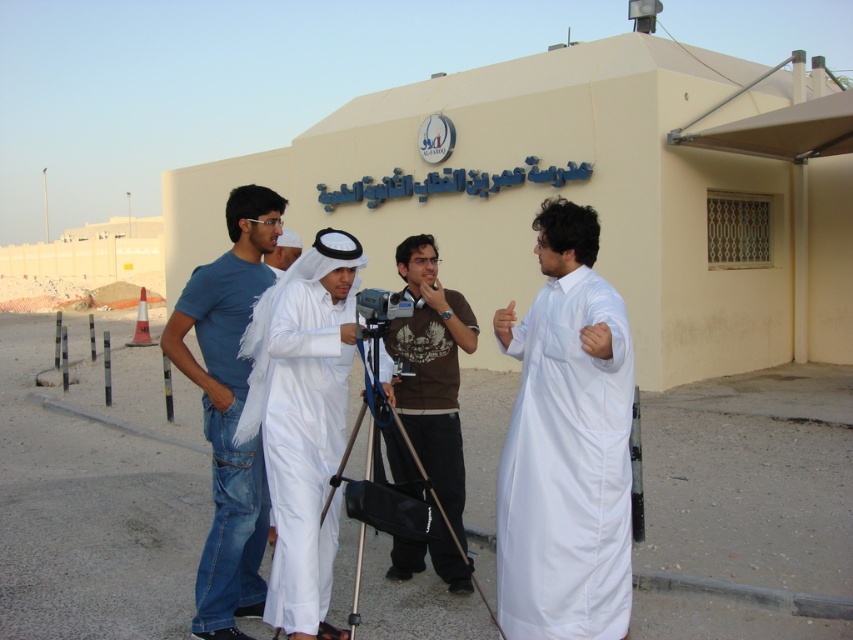
You are standing in front of the building with Arabic script and want to place two markers on the ground at the coordinates point (577,380) and point (428,403). Which marker will be closer to you?

Point (577,380) is closer to the viewer than point (428,403), so the marker at point (577,380) will be closer to you.